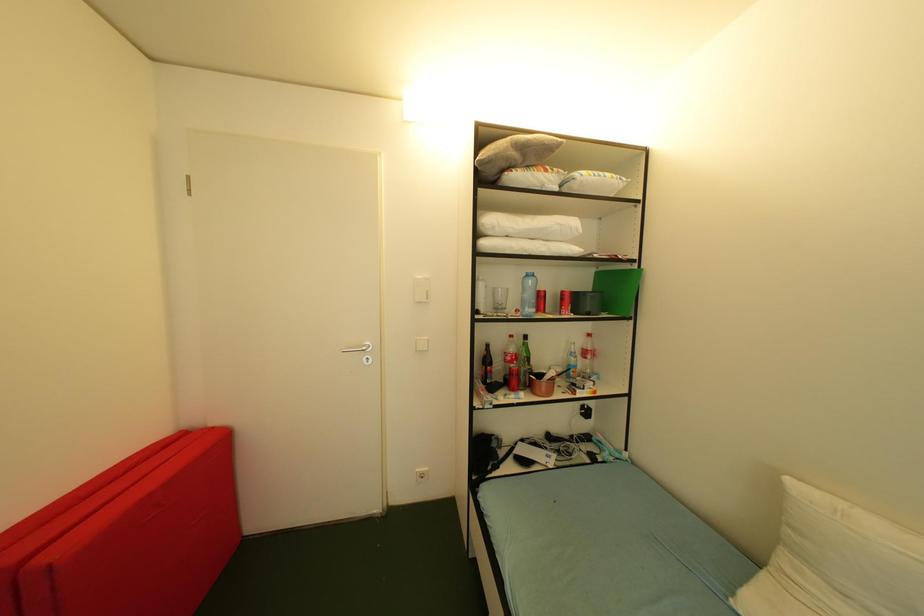
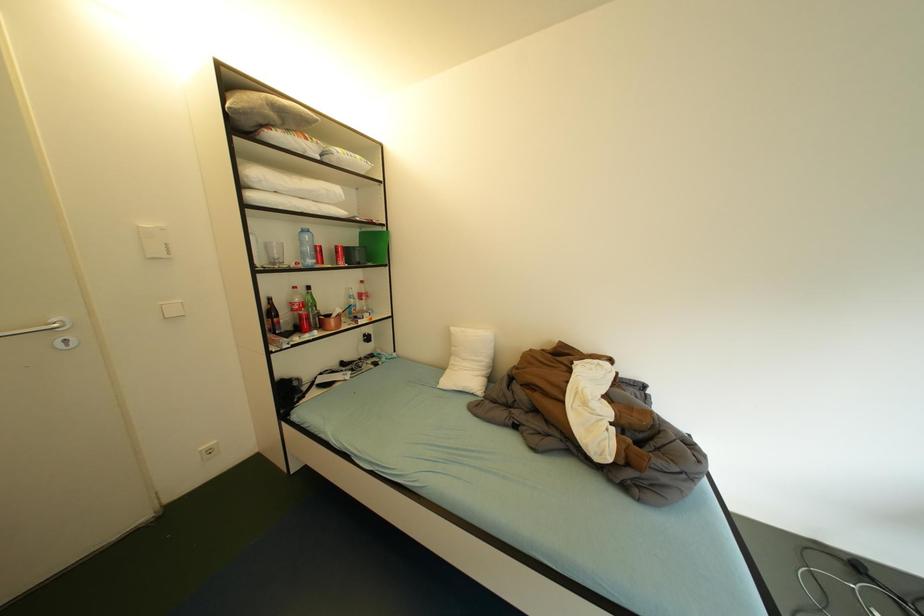
Question: Based on the continuous images, in which direction is the camera rotating? Reply with the corresponding letter.

Choices:
 (A) Left
 (B) Right
 (C) Up
 (D) Down

Answer: (B)